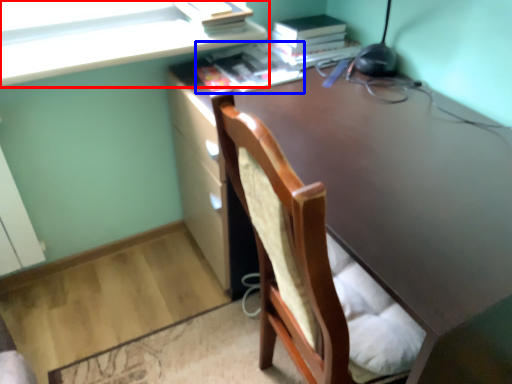
Question: Among these objects, which one is nearest to the camera, cabinetry (highlighted by a red box) or book (highlighted by a blue box)?

Choices:
 (A) cabinetry
 (B) book

Answer: (A)